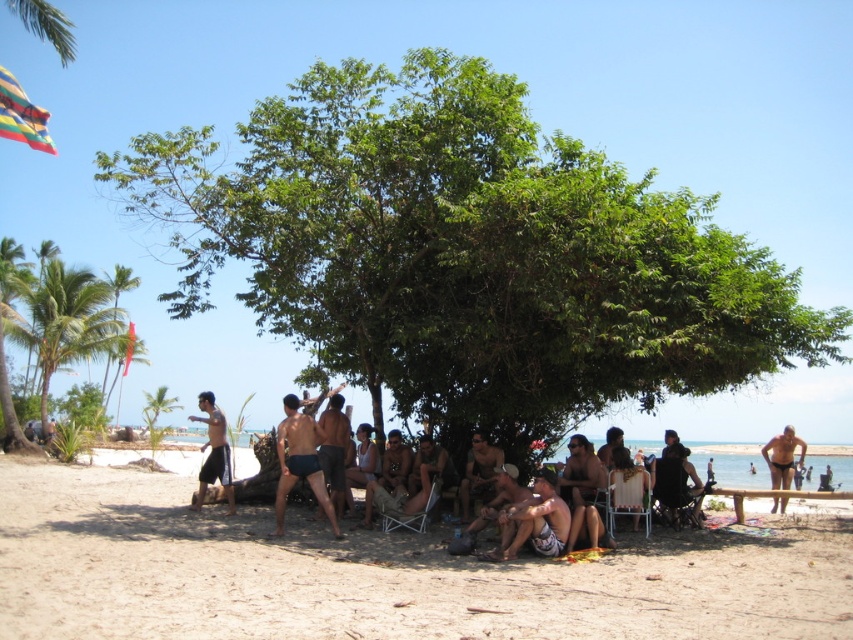
Based on the photo, which is more to the right, tan skin man at center or matte black shorts at center?

From the viewer's perspective, tan skin man at center appears more on the right side.

Does tan skin man at center have a lesser height compared to matte black shorts at center?

Incorrect, tan skin man at center's height does not fall short of matte black shorts at center's.

Who is more forward, [582,460] or [466,525]?

Point [466,525] is in front.

The height and width of the screenshot is (640, 853). In order to click on tan skin man at center in this screenshot , I will do `click(582, 477)`.

Does dark blue swim trunks at center appear over matte black shorts at left?

Yes.

Who is higher up, dark blue swim trunks at center or matte black shorts at left?

dark blue swim trunks at center is above.

Who is more distant from viewer, [283,400] or [218,476]?

The point [283,400] is behind.

The width and height of the screenshot is (853, 640). Identify the location of dark blue swim trunks at center. click(300, 461).

Does green leafy tree at left appear over matte black shorts at lower right?

Correct, green leafy tree at left is located above matte black shorts at lower right.

From the picture: Between green leafy tree at left and matte black shorts at lower right, which one is positioned higher?

Positioned higher is green leafy tree at left.

Which is behind, point (103, 332) or point (782, 499)?

The point (103, 332) is more distant.

Where is `green leafy tree at left`? green leafy tree at left is located at coordinates (50, 323).